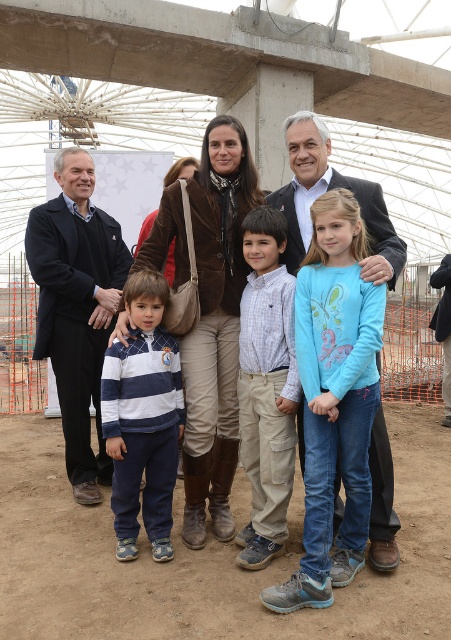
You are a photographer trying to capture a clear shot of the brown dirt field at lower center and the navy blue striped sweater at lower left. Based on their positions, which object is closer to the camera?

The brown dirt field at lower center is closer to the camera because it is in front of the navy blue striped sweater at lower left.

You are a photographer at the construction site scene. You need to decide which clothing item, the brown leather jacket at center or the navy blue striped sweater at lower left, requires a larger storage space in your equipment bag. Which one do you choose?

The brown leather jacket at center is bigger than the navy blue striped sweater at lower left, so it requires more storage space. You should choose the brown leather jacket at center for the larger storage space.